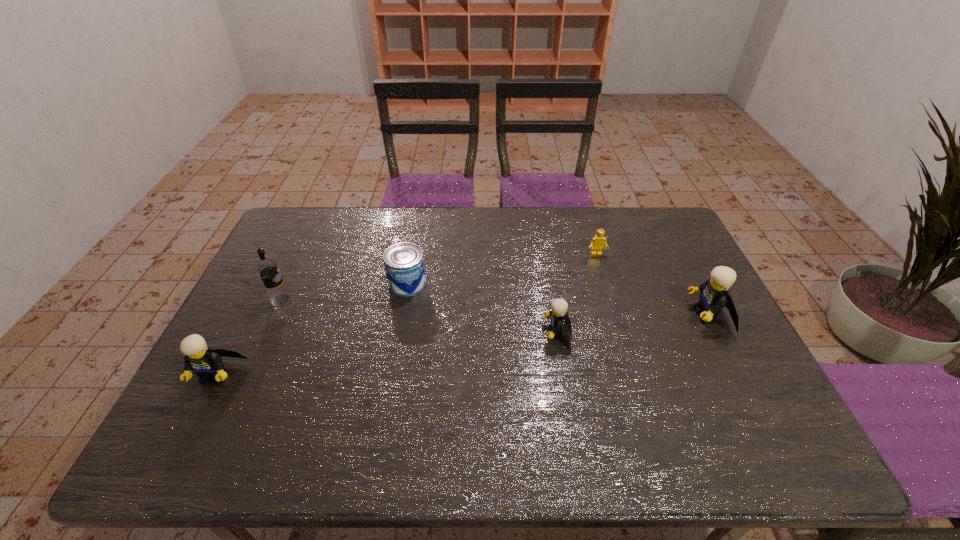
Please determine a free point for an extra Lego to ensure balance. Please provide its 2D coordinates. Your answer should be formatted as a tuple, i.e. [(x, y)], where the tuple contains the x and y coordinates of a point satisfying the conditions above.

[(394, 353)]